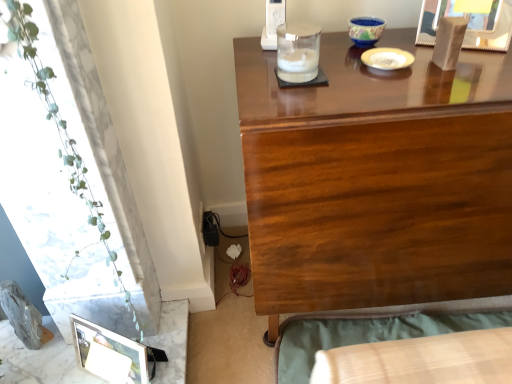
Question: Can you confirm if clear glass candle holder at upper center, the 2th candle holder from the right, is bigger than blue ceramic bowl at upper center, positioned as the first candle holder in right-to-left order?

Choices:
 (A) yes
 (B) no

Answer: (A)

Question: Is clear glass candle holder at upper center, the second candle holder positioned from the back, positioned beyond the bounds of blue ceramic bowl at upper center, the first candle holder in the back-to-front sequence?

Choices:
 (A) yes
 (B) no

Answer: (A)

Question: From the image's perspective, is clear glass candle holder at upper center, arranged as the 1th candle holder when viewed from the front, below blue ceramic bowl at upper center, which appears as the second candle holder when viewed from the front?

Choices:
 (A) no
 (B) yes

Answer: (B)

Question: Is clear glass candle holder at upper center, the second candle holder positioned from the back, turned away from blue ceramic bowl at upper center, which appears as the second candle holder when viewed from the front?

Choices:
 (A) no
 (B) yes

Answer: (A)

Question: Is the depth of clear glass candle holder at upper center, which is the first candle holder in bottom-to-top order, greater than that of blue ceramic bowl at upper center, which is the 2th candle holder from bottom to top?

Choices:
 (A) no
 (B) yes

Answer: (A)

Question: Considering the relative positions of clear glass candle holder at upper center, which is the first candle holder in bottom-to-top order, and blue ceramic bowl at upper center, the first candle holder in the back-to-front sequence, in the image provided, is clear glass candle holder at upper center, which is the first candle holder in bottom-to-top order, to the right of blue ceramic bowl at upper center, the first candle holder in the back-to-front sequence, from the viewer's perspective?

Choices:
 (A) yes
 (B) no

Answer: (B)

Question: Is glossy wood desk at upper center oriented away from wooden bed frame at lower right?

Choices:
 (A) yes
 (B) no

Answer: (B)

Question: Is glossy wood desk at upper center not inside wooden bed frame at lower right?

Choices:
 (A) no
 (B) yes

Answer: (B)

Question: Does glossy wood desk at upper center have a lesser height compared to wooden bed frame at lower right?

Choices:
 (A) yes
 (B) no

Answer: (B)

Question: Does glossy wood desk at upper center come in front of wooden bed frame at lower right?

Choices:
 (A) yes
 (B) no

Answer: (A)

Question: Is glossy wood desk at upper center bigger than wooden bed frame at lower right?

Choices:
 (A) yes
 (B) no

Answer: (A)

Question: From the image's perspective, would you say glossy wood desk at upper center is shown under wooden bed frame at lower right?

Choices:
 (A) yes
 (B) no

Answer: (B)

Question: From a real-world perspective, is green leafy plant at left under white glossy plate at upper center?

Choices:
 (A) yes
 (B) no

Answer: (A)